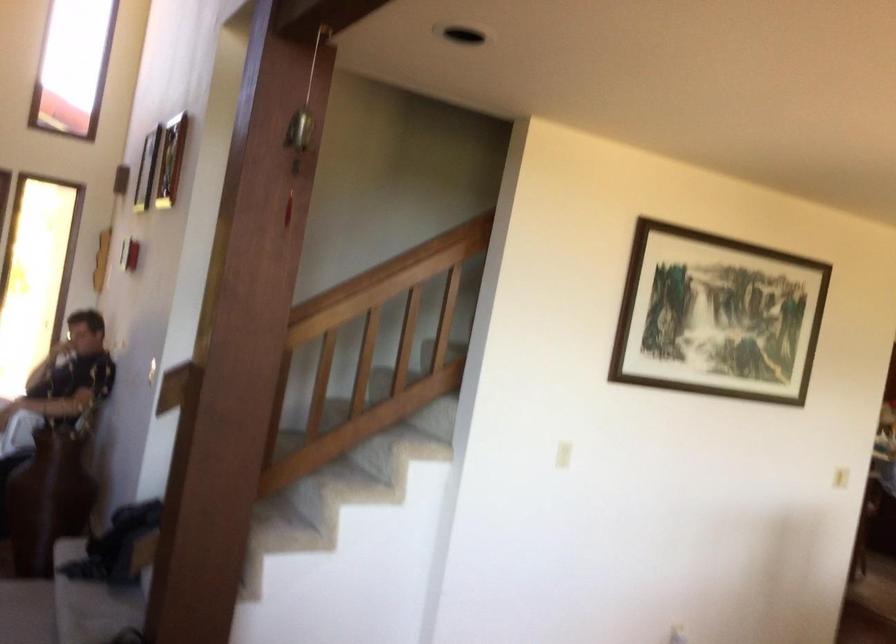
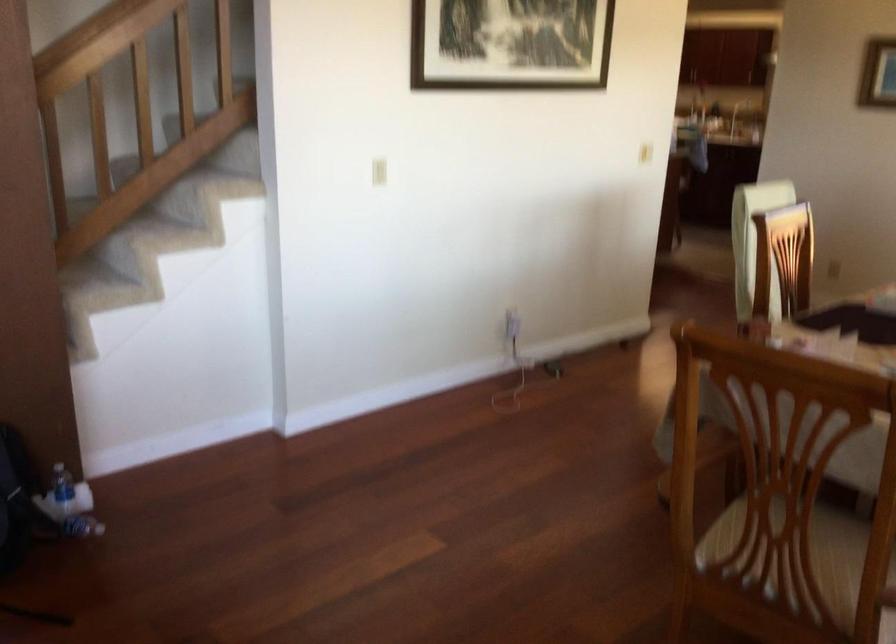
Question: How did the camera likely rotate?

Choices:
 (A) Left
 (B) Right
 (C) Up
 (D) Down

Answer: (D)